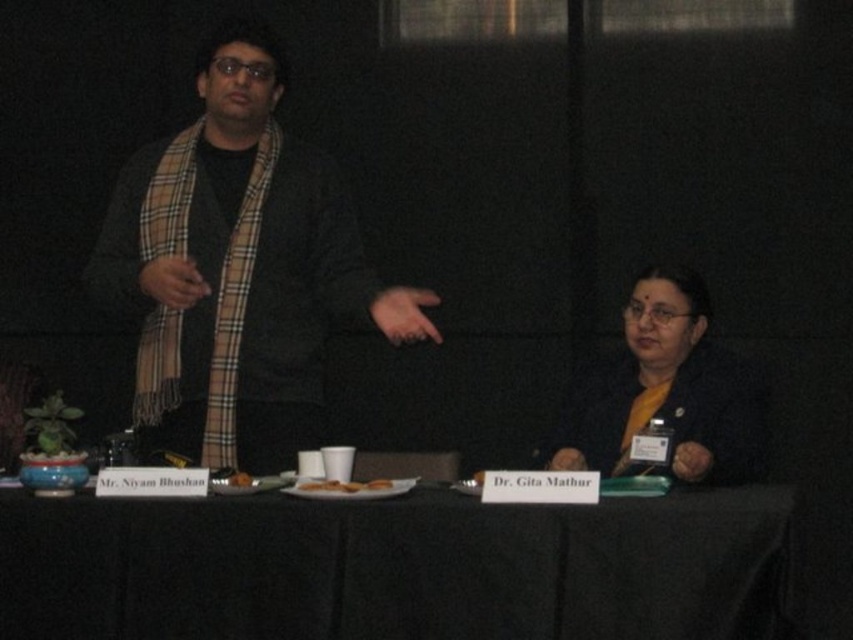
What is located at the coordinates point (344, 486)?

The point (344, 486) is on brown matte bread at center.

You are a photographer at a formal event. You need to capture a closeup of the brown crumbly cookie at center without including the yellow matte shirt at lower right in the frame. Is this possible based on their sizes?

The yellow matte shirt at lower right has a larger size compared to brown crumbly cookie at center. Therefore, it might be challenging to capture the cookie without including the shirt in the frame due to the shirt being larger and possibly overlapping or dominating the composition.

You are a guest at this event and want to choose the larger item between the brown matte bread at center and the brown crumbly cookie at center on the table. Which one should you pick?

The brown matte bread at center is bigger than the brown crumbly cookie at center, so you should pick the brown matte bread at center.